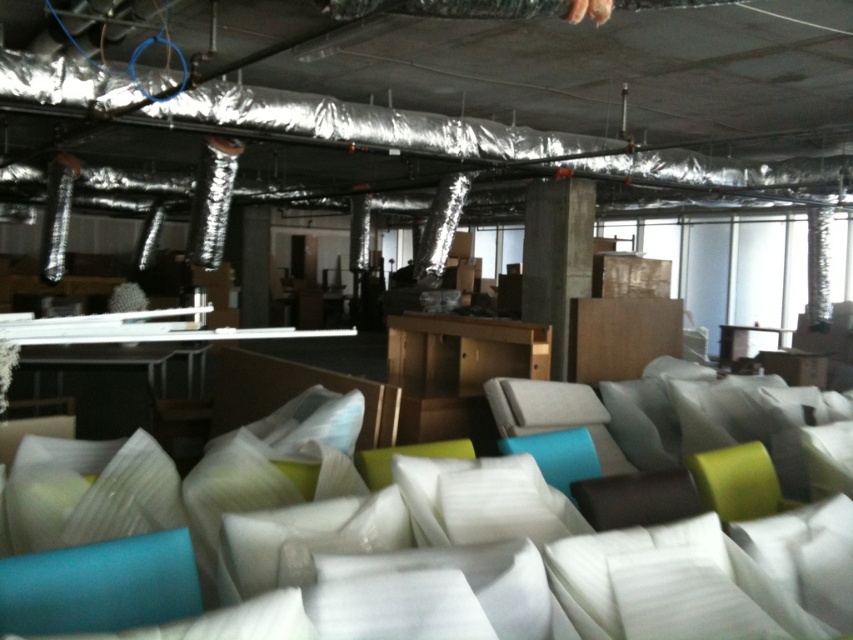
This screenshot has width=853, height=640. What do you see at coordinates (427, 541) in the screenshot?
I see `white fabric couch at center` at bounding box center [427, 541].

Does white fabric couch at center have a larger size compared to wooden cabinet at center?

Yes.

Find the location of a particular element. This screenshot has height=640, width=853. white fabric couch at center is located at coordinates (427, 541).

This screenshot has width=853, height=640. What are the coordinates of `white fabric couch at center` in the screenshot? It's located at (427, 541).

Does wooden cabinet at center lie in front of concrete at center?

That is True.

Which of these two, wooden cabinet at center or concrete at center, stands shorter?

With less height is wooden cabinet at center.

Where is `wooden cabinet at center`? This screenshot has width=853, height=640. wooden cabinet at center is located at coordinates (457, 371).

Can you confirm if white fabric couch at center is shorter than concrete at center?

Yes, white fabric couch at center is shorter than concrete at center.

Based on the photo, which is above, white fabric couch at center or concrete at center?

concrete at center

Between point (273, 488) and point (550, 321), which one is positioned behind?

The point (550, 321) is behind.

Image resolution: width=853 pixels, height=640 pixels. Identify the location of white fabric couch at center. (427, 541).